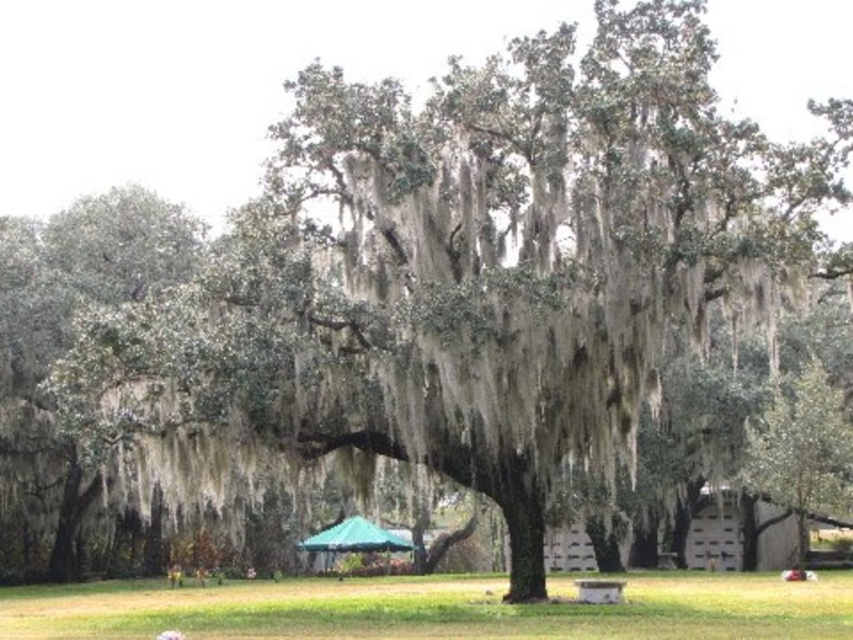
Can you confirm if green mossy tree at center is shorter than green fabric canopy at center?

In fact, green mossy tree at center may be taller than green fabric canopy at center.

Locate an element on the screen. green mossy tree at center is located at coordinates (799, 452).

Is point (816, 372) less distant than point (605, 589)?

No, (816, 372) is further to viewer.

From the picture: Can you confirm if green mossy tree at center is shorter than wooden park bench at center?

No.

Locate an element on the screen. The height and width of the screenshot is (640, 853). green mossy tree at center is located at coordinates (799, 452).

Who is lower down, green fabric canopy at center or wooden park bench at center?

Positioned lower is green fabric canopy at center.

Who is more forward, (312,540) or (585,580)?

Positioned in front is point (585,580).

Identify the location of green fabric canopy at center. (354, 538).